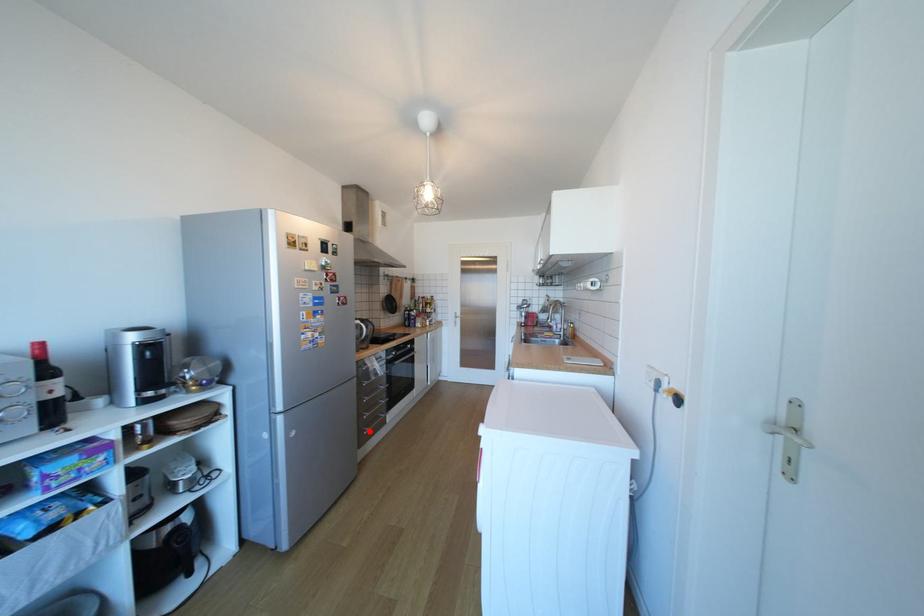
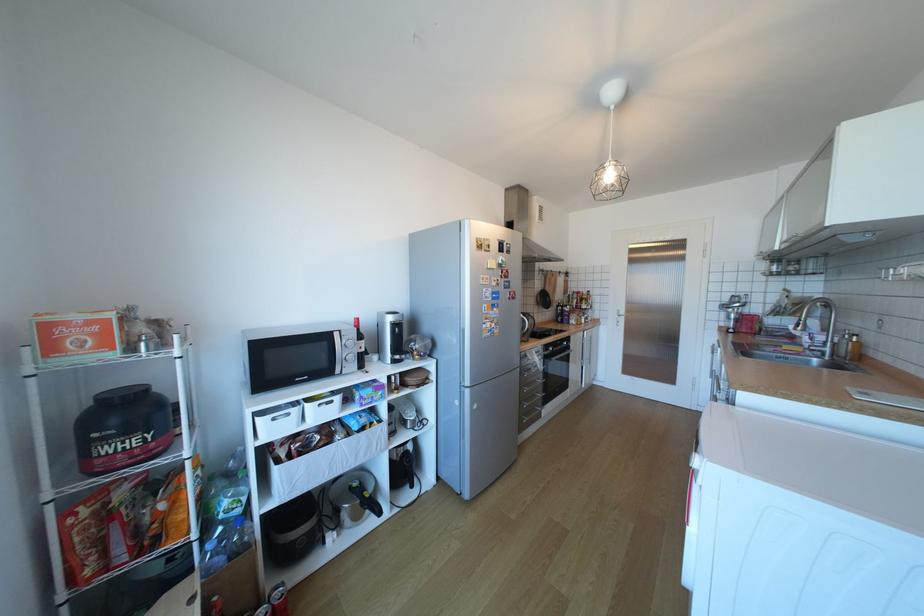
In the second image, find the point that corresponds to the highlighted location in the first image.

(529, 419)